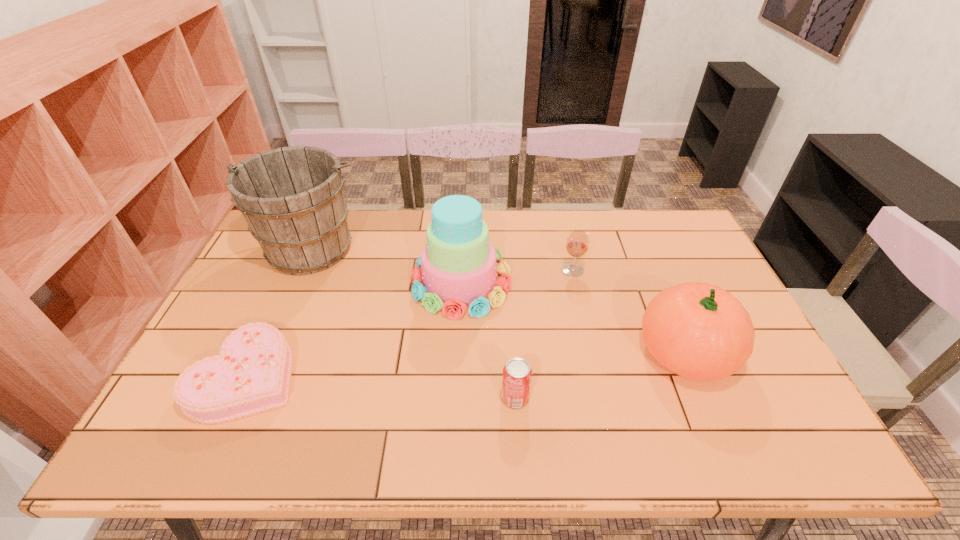
This screenshot has height=540, width=960. Identify the location of blank space that satisfies the following two spatial constraints: 1. on the back side of the fifth object from left to right; 2. on the left side of the right cake. (462, 270).

I want to click on free space that satisfies the following two spatial constraints: 1. on the back side of the soda can; 2. on the left side of the third tallest object, so click(x=512, y=352).

I want to click on free space that satisfies the following two spatial constraints: 1. on the front side of the fifth object from left to right; 2. on the left side of the pumpkin, so click(591, 352).